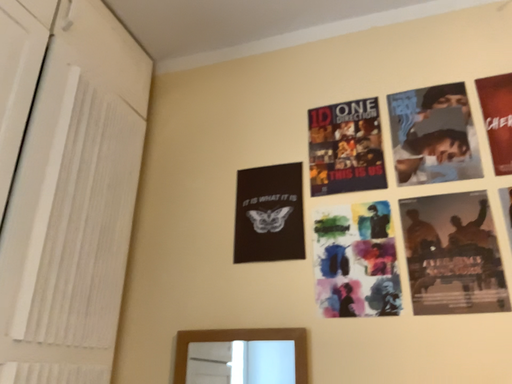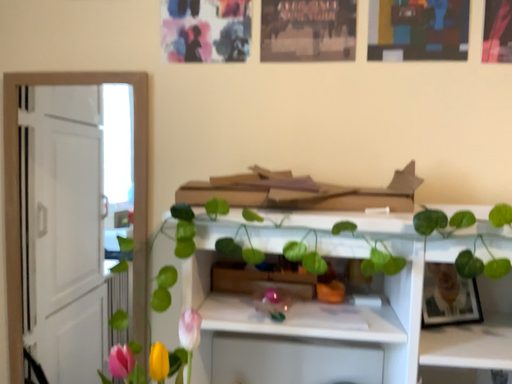
Question: Which way did the camera rotate in the video?

Choices:
 (A) rotated right
 (B) rotated left

Answer: (A)